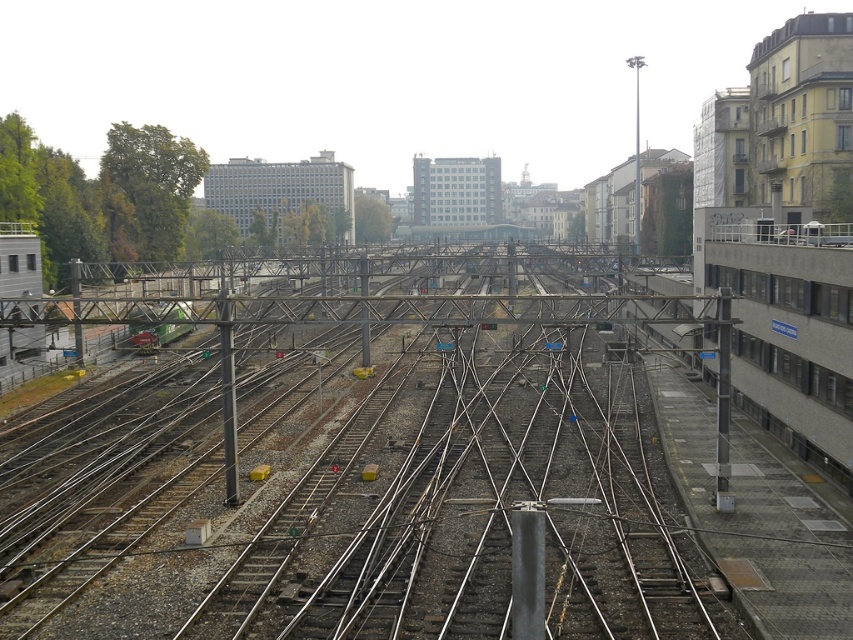
Does metal at center appear under green matte train at center?

Correct, metal at center is located below green matte train at center.

Between metal at center and green matte train at center, which one appears on the right side from the viewer's perspective?

Positioned to the right is metal at center.

Locate an element on the screen. metal at center is located at coordinates (357, 481).

Find the location of a particular element. metal at center is located at coordinates (357, 481).